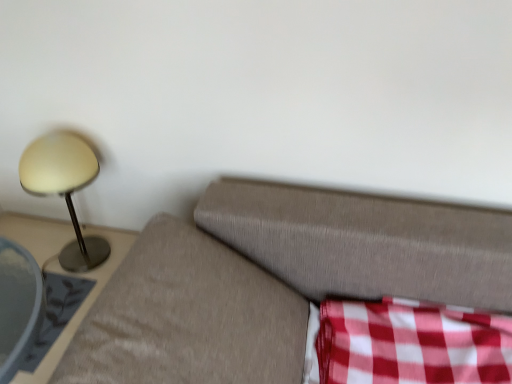
The width and height of the screenshot is (512, 384). Describe the element at coordinates (411, 343) in the screenshot. I see `red checkered fabric at lower right` at that location.

You are a GUI agent. You are given a task and a screenshot of the screen. Output one action in this format:
    pyautogui.click(x=<x>, y=<y>)
    Task: Click on the matte gold lamp at left
    
    Given the screenshot: What is the action you would take?
    pyautogui.click(x=64, y=189)

Does metallic gray side table at left have a lesser height compared to red checkered fabric at lower right?

Incorrect, the height of metallic gray side table at left does not fall short of that of red checkered fabric at lower right.

Considering the relative sizes of metallic gray side table at left and red checkered fabric at lower right in the image provided, is metallic gray side table at left wider than red checkered fabric at lower right?

Indeed, metallic gray side table at left has a greater width compared to red checkered fabric at lower right.

Is point (122, 232) in front of point (447, 341)?

No.

From the image's perspective, would you say matte gold lamp at left is positioned over metallic gray side table at left?

Indeed, from the image's perspective, matte gold lamp at left is shown above metallic gray side table at left.

Visually, is matte gold lamp at left positioned to the left or to the right of metallic gray side table at left?

matte gold lamp at left is to the right of metallic gray side table at left.

Does matte gold lamp at left have a smaller size compared to metallic gray side table at left?

Correct, matte gold lamp at left occupies less space than metallic gray side table at left.

At what (x,y) coordinates should I click in order to perform the action: click on plaid that appears below the matte gold lamp at left (from the image's perspective). Please return your answer as a coordinate pair (x, y). Image resolution: width=512 pixels, height=384 pixels. Looking at the image, I should click on (411, 343).

Is red checkered fabric at lower right a part of matte gold lamp at left?

No, matte gold lamp at left does not contain red checkered fabric at lower right.

From the image's perspective, is matte gold lamp at left positioned above or below red checkered fabric at lower right?

matte gold lamp at left is above red checkered fabric at lower right.

Who is taller, red checkered fabric at lower right or metallic gray side table at left?

metallic gray side table at left.

Image resolution: width=512 pixels, height=384 pixels. What are the coordinates of `furniture that is on the left side of red checkered fabric at lower right` in the screenshot? It's located at (62, 273).

From a real-world perspective, is red checkered fabric at lower right positioned above or below metallic gray side table at left?

red checkered fabric at lower right is situated higher than metallic gray side table at left in the real world.

From a real-world perspective, which is physically below, metallic gray side table at left or matte gold lamp at left?

metallic gray side table at left.

Is metallic gray side table at left aimed at matte gold lamp at left?

No, metallic gray side table at left is not aimed at matte gold lamp at left.

Considering the relative positions of metallic gray side table at left and matte gold lamp at left in the image provided, is metallic gray side table at left to the left or to the right of matte gold lamp at left?

In the image, metallic gray side table at left appears on the left side of matte gold lamp at left.

Based on the photo, can you confirm if red checkered fabric at lower right is taller than matte gold lamp at left?

No.

Which of these two, red checkered fabric at lower right or matte gold lamp at left, is thinner?

matte gold lamp at left is thinner.

Is point (482, 369) closer or farther from the camera than point (108, 253)?

Point (482, 369) appears to be closer to the viewer than point (108, 253).

In the scene shown: From a real-world perspective, between red checkered fabric at lower right and matte gold lamp at left, who is vertically lower?

red checkered fabric at lower right is physically lower.

This screenshot has height=384, width=512. Find the location of `plaid behind the metallic gray side table at left`. plaid behind the metallic gray side table at left is located at coordinates (411, 343).

In the image, there is a matte gold lamp at left. At what (x,y) coordinates should I click in order to perform the action: click on furniture below it (from a real-world perspective). Please return your answer as a coordinate pair (x, y). Looking at the image, I should click on (62, 273).

From the picture: From the image, which object appears to be nearer to metallic gray side table at left, matte gold lamp at left or red checkered fabric at lower right?

The object closer to metallic gray side table at left is matte gold lamp at left.

Estimate the real-world distances between objects in this image. Which object is further from metallic gray side table at left, red checkered fabric at lower right or matte gold lamp at left?

Among the two, red checkered fabric at lower right is located further to metallic gray side table at left.

Which object lies further to the anchor point matte gold lamp at left, red checkered fabric at lower right or metallic gray side table at left?

red checkered fabric at lower right.

Considering their positions, is metallic gray side table at left positioned further to red checkered fabric at lower right than matte gold lamp at left?

Among the two, matte gold lamp at left is located further to red checkered fabric at lower right.

From the image, which object appears to be nearer to matte gold lamp at left, metallic gray side table at left or red checkered fabric at lower right?

The object closer to matte gold lamp at left is metallic gray side table at left.

In the scene shown: Which object lies nearer to the anchor point red checkered fabric at lower right, matte gold lamp at left or metallic gray side table at left?

metallic gray side table at left is closer to red checkered fabric at lower right.

This screenshot has height=384, width=512. I want to click on lamp between metallic gray side table at left and red checkered fabric at lower right in the horizontal direction, so click(x=64, y=189).